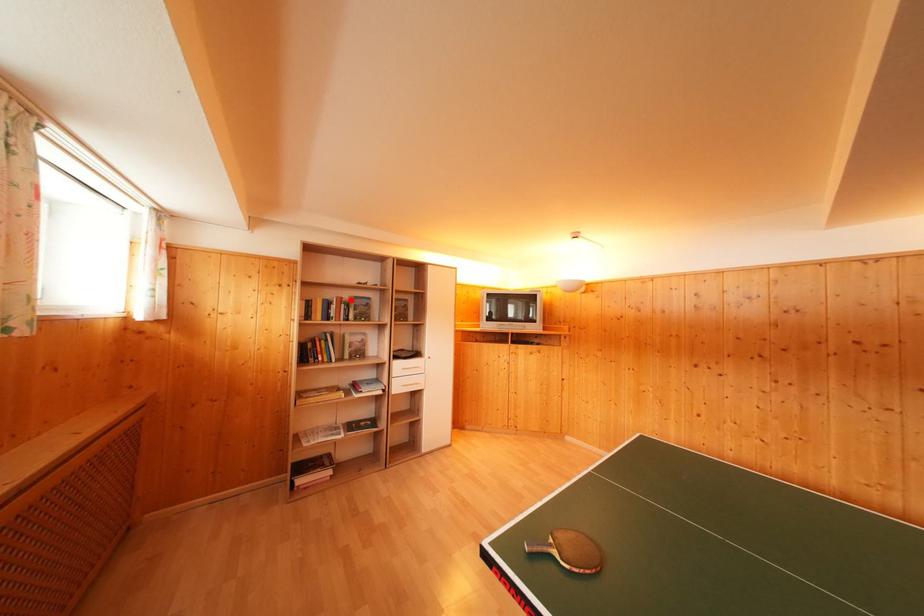
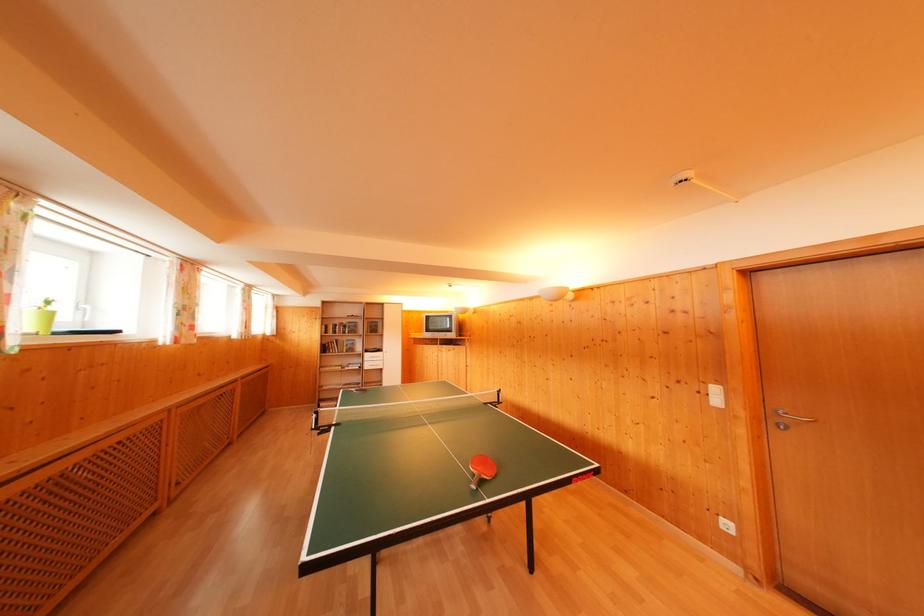
Find the pixel in the second image that matches the highlighted location in the first image.

(349, 326)